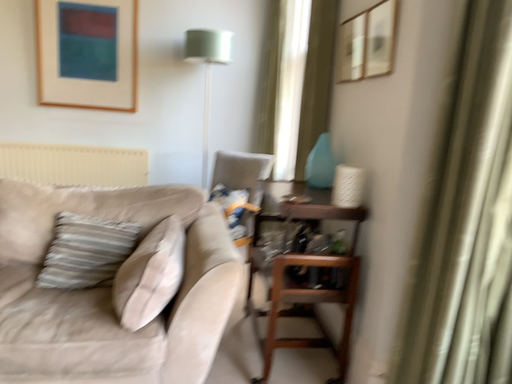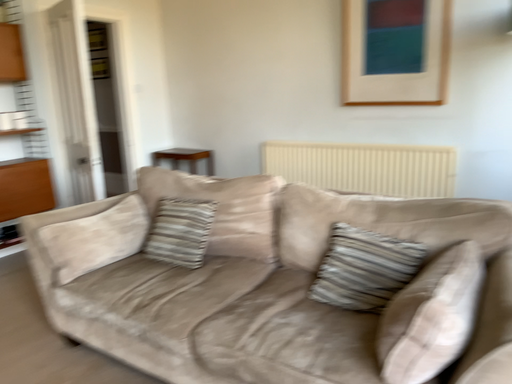
Question: Which way did the camera rotate in the video?

Choices:
 (A) rotated left
 (B) rotated right

Answer: (A)